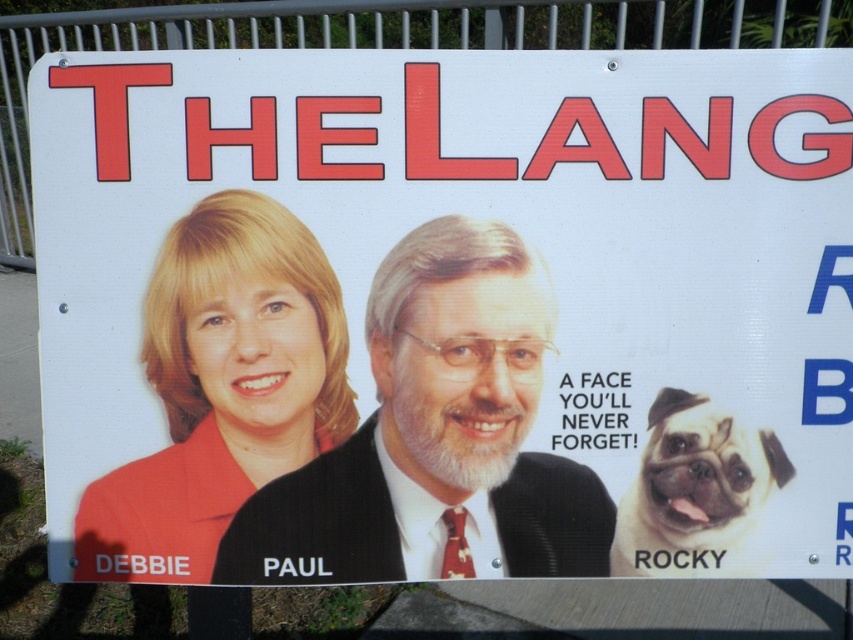
Question: Which object is farther from the camera taking this photo?

Choices:
 (A) white fur dog at lower right
 (B) matte black suit at center

Answer: (A)

Question: Observing the image, what is the correct spatial positioning of matte black suit at center in reference to white fur dog at lower right?

Choices:
 (A) above
 (B) below

Answer: (A)

Question: Which of the following is the farthest from the observer?

Choices:
 (A) white fur dog at lower right
 (B) matte black suit at center

Answer: (A)

Question: Does matte black suit at center appear on the left side of white fur dog at lower right?

Choices:
 (A) yes
 (B) no

Answer: (A)

Question: Does matte black suit at center have a lesser width compared to white fur dog at lower right?

Choices:
 (A) yes
 (B) no

Answer: (B)